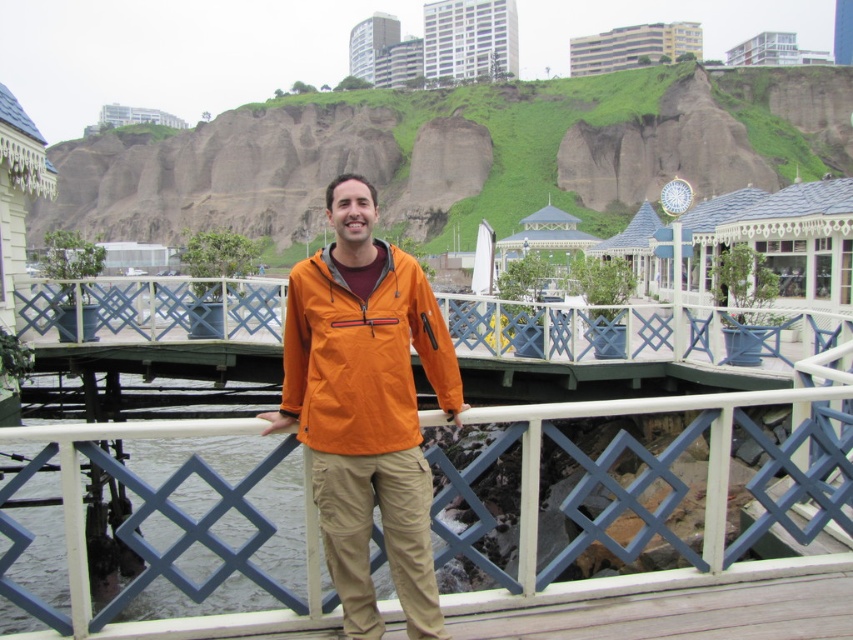
Question: Which object appears closest to the camera in this image?

Choices:
 (A) white painted wood at center
 (B) orange fabric jacket at center

Answer: (A)

Question: Estimate the real-world distances between objects in this image. Which object is closer to the white painted wood at center?

Choices:
 (A) orange softshell jacket at center
 (B) orange fabric jacket at center

Answer: (B)

Question: Is orange fabric jacket at center bigger than orange softshell jacket at center?

Choices:
 (A) no
 (B) yes

Answer: (B)

Question: Considering the real-world distances, which object is farthest from the orange softshell jacket at center?

Choices:
 (A) orange fabric jacket at center
 (B) white painted wood at center

Answer: (B)

Question: Is white painted wood at center positioned behind orange softshell jacket at center?

Choices:
 (A) yes
 (B) no

Answer: (B)

Question: Does orange fabric jacket at center appear on the left side of orange softshell jacket at center?

Choices:
 (A) no
 (B) yes

Answer: (B)